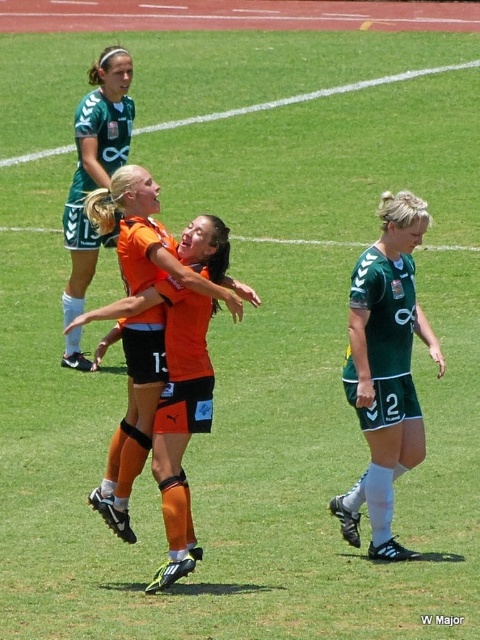
Who is positioned more to the left, orange matte jersey at center or green jersey at upper left?

green jersey at upper left

Does orange matte jersey at center have a smaller size compared to green jersey at upper left?

Actually, orange matte jersey at center might be larger than green jersey at upper left.

This screenshot has height=640, width=480. I want to click on orange matte jersey at center, so click(x=132, y=413).

Locate an element on the screen. orange matte jersey at center is located at coordinates (132, 413).

Does green matte jersey at center have a lesser width compared to orange matte jersey at center?

Yes.

How much distance is there between green matte jersey at center and orange matte jersey at center?

38.62 inches

Is point (396, 464) farther from camera compared to point (239, 289)?

Yes, it is behind point (239, 289).

Identify the location of green matte jersey at center. (385, 369).

Can you confirm if green matte jersey at center is shorter than green jersey at upper left?

Yes.

Is green matte jersey at center behind green jersey at upper left?

That is False.

Which is in front, point (374, 250) or point (81, 362)?

Positioned in front is point (374, 250).

In order to click on green matte jersey at center in this screenshot , I will do `click(385, 369)`.